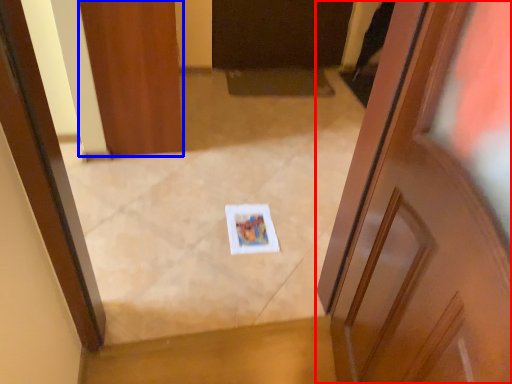
Question: Which point is closer to the camera, door (highlighted by a red box) or door (highlighted by a blue box)?

Choices:
 (A) door
 (B) door

Answer: (A)